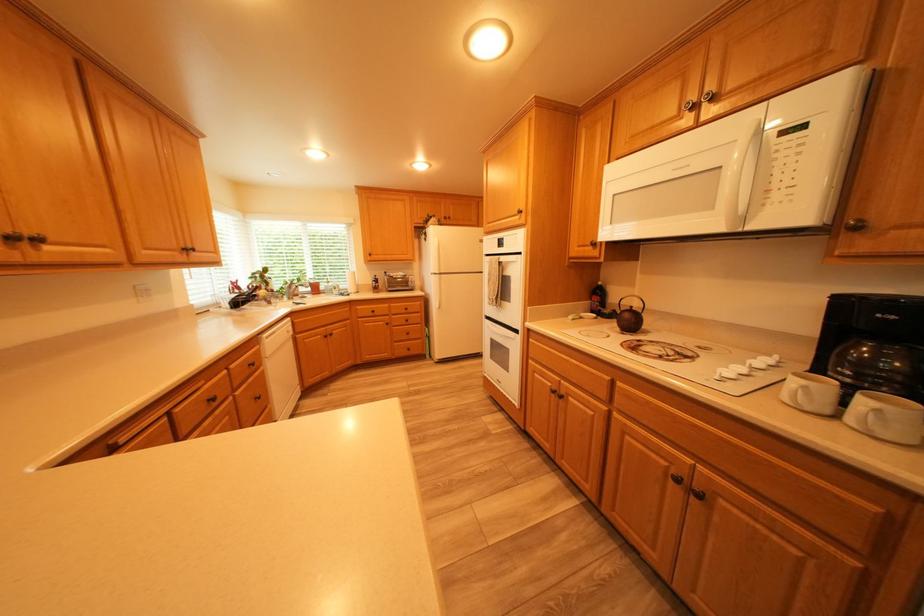
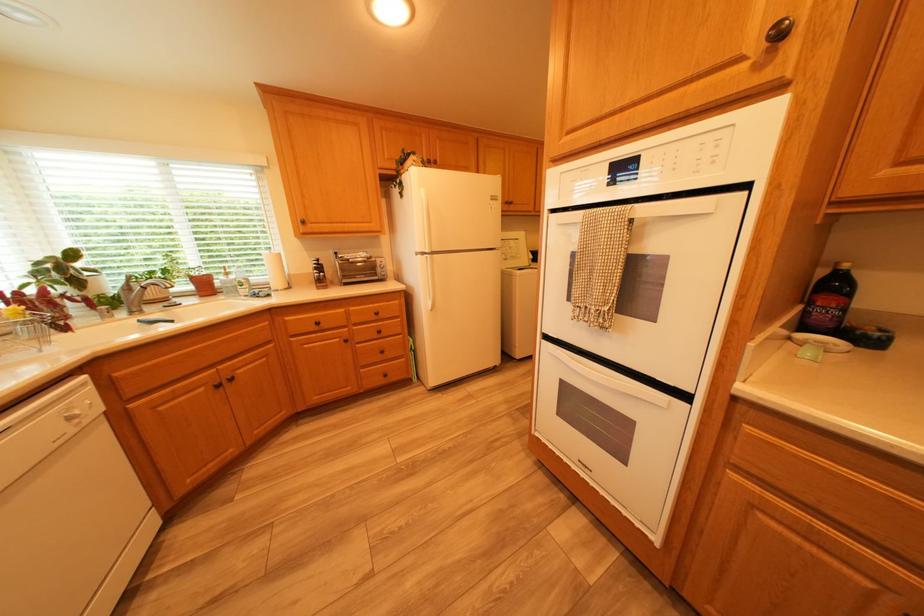
Locate, in the second image, the point that corresponds to (x=383, y=259) in the first image.

(317, 230)